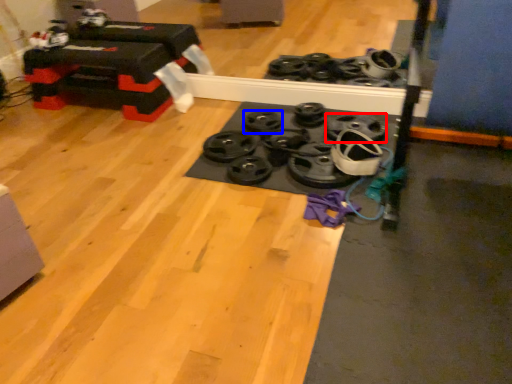
Question: Which point is further to the camera, wheel (highlighted by a red box) or wheel (highlighted by a blue box)?

Choices:
 (A) wheel
 (B) wheel

Answer: (B)